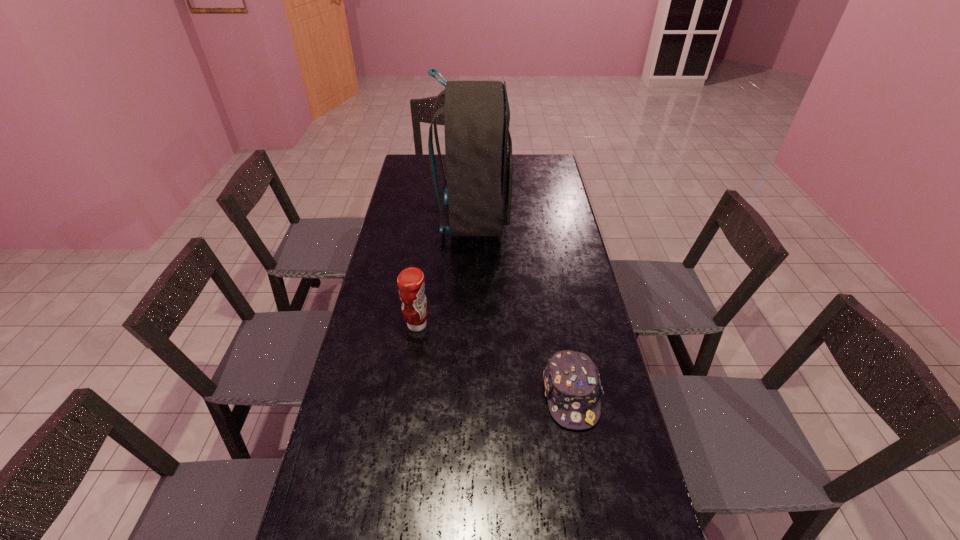
Where is `the tallest object`? This screenshot has height=540, width=960. the tallest object is located at coordinates (478, 147).

I want to click on the farthest object, so click(478, 147).

You are a GUI agent. You are given a task and a screenshot of the screen. Output one action in this format:
    pyautogui.click(x=<x>, y=<y>)
    Task: Click on the second tallest object
    The height and width of the screenshot is (540, 960).
    Given the screenshot: What is the action you would take?
    pyautogui.click(x=410, y=281)

The image size is (960, 540). What are the coordinates of `the second nearest object` in the screenshot? It's located at (410, 281).

At what (x,y) coordinates should I click in order to perform the action: click on the shortest object. Please return your answer as a coordinate pair (x, y). This screenshot has height=540, width=960. Looking at the image, I should click on (572, 384).

Locate an element on the screen. This screenshot has height=540, width=960. headwear is located at coordinates (572, 384).

Locate an element on the screen. free space located 0.260m on the front-facing side of the backpack is located at coordinates (573, 219).

The width and height of the screenshot is (960, 540). I want to click on free spot located 0.060m on the front of the second nearest object, so click(413, 354).

Locate an element on the screen. Image resolution: width=960 pixels, height=540 pixels. free region located on the front-facing side of the rightmost object is located at coordinates (596, 536).

The image size is (960, 540). I want to click on object located at the left edge, so click(410, 281).